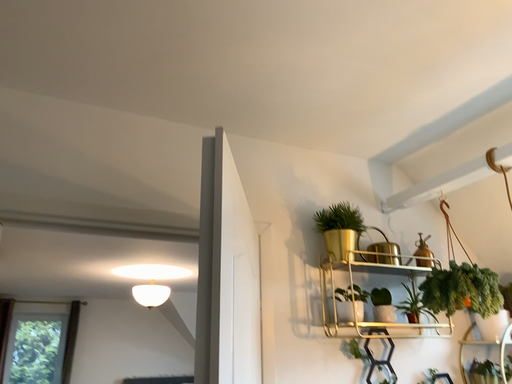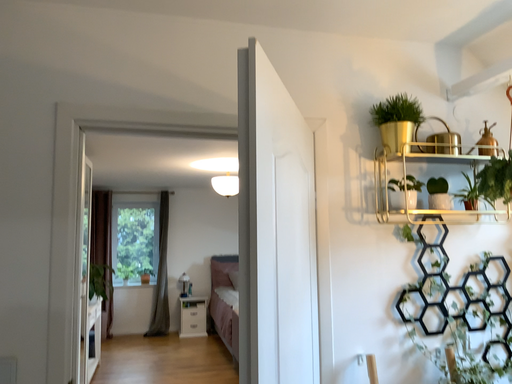
Question: How did the camera likely rotate when shooting the video?

Choices:
 (A) rotated right
 (B) rotated left

Answer: (B)